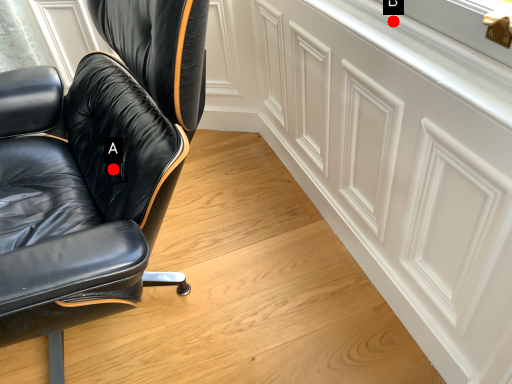
Question: Two points are circled on the image, labeled by A and B beside each circle. Which of the following is the closest to the observer?

Choices:
 (A) A is closer
 (B) B is closer

Answer: (B)